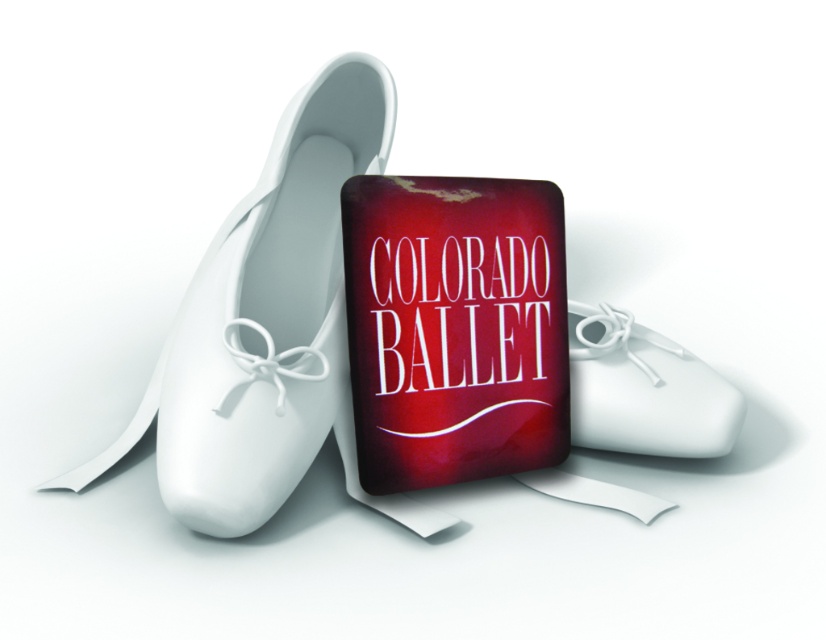
You are a photographer setting up a shoot with a matte white ballet shoe at center. You need to place a spotlight exactly 1 meter away from the shoe. Where should you position the spotlight relative to the shoe?

The matte white ballet shoe at center is 87.88 centimeters from the camera. To place the spotlight exactly 1 meter away from the shoe, position it 12.12 centimeters further away from the camera than the current position of the shoe.